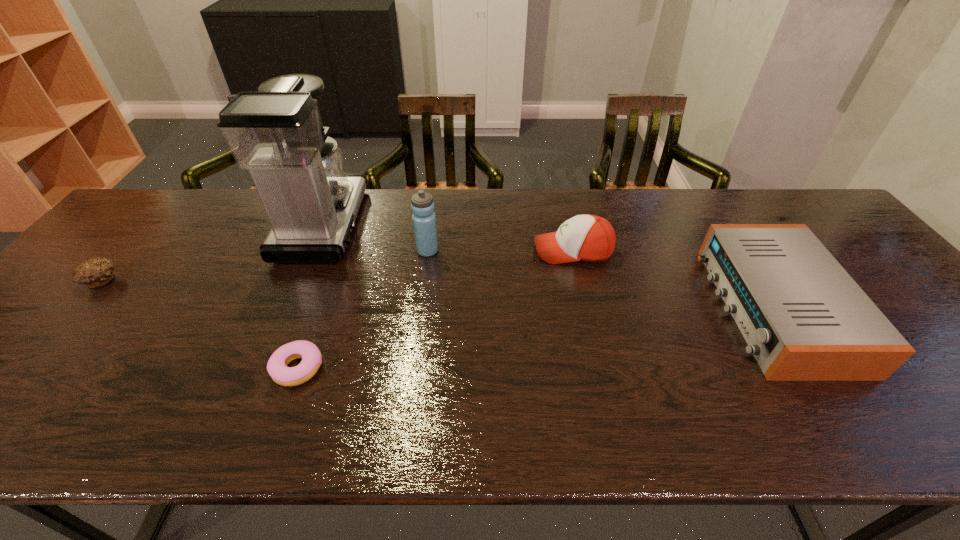
Find the location of `the tallest object`. the tallest object is located at coordinates (311, 203).

This screenshot has width=960, height=540. Find the location of `the fifth shortest object`. the fifth shortest object is located at coordinates (424, 220).

Where is `water bottle`? water bottle is located at coordinates click(424, 220).

Locate an element on the screen. baseball cap is located at coordinates (589, 238).

Where is `the rightmost object`? the rightmost object is located at coordinates (804, 318).

This screenshot has height=540, width=960. I want to click on the leftmost object, so click(96, 272).

Where is `muffin`? This screenshot has width=960, height=540. muffin is located at coordinates (96, 272).

This screenshot has height=540, width=960. What are the coordinates of `doughnut` in the screenshot? It's located at (311, 357).

You are a GUI agent. You are given a task and a screenshot of the screen. Output one action in this format:
    pyautogui.click(x=<x>, y=<y>)
    Task: Click on the vacant space positioned at the front of the coffee maker where the controls are located
    
    Given the screenshot: What is the action you would take?
    pyautogui.click(x=454, y=225)

Locate an element on the screen. vacant space located on the left of the second tallest object is located at coordinates (367, 251).